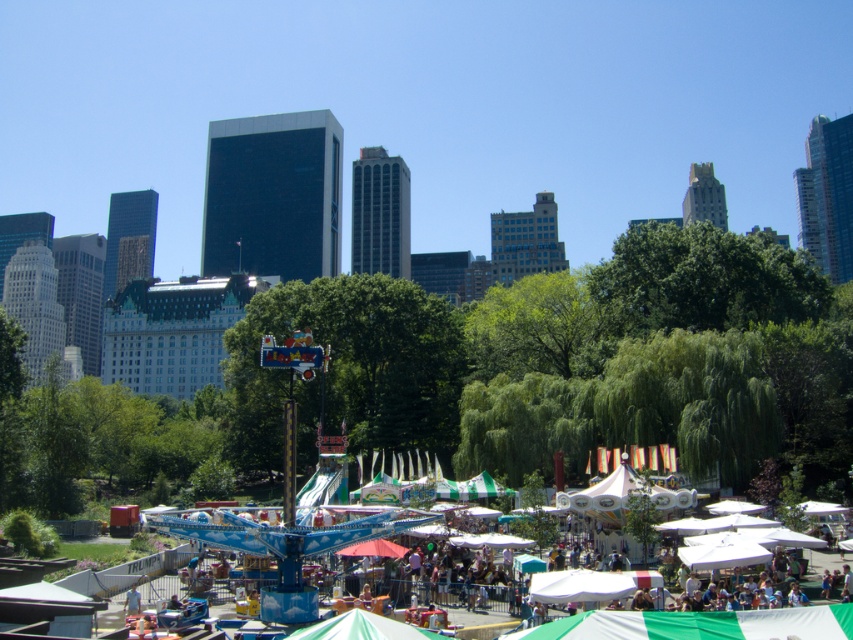
Question: From the image, what is the correct spatial relationship of green fabric canopy at lower center in relation to green fabric canopy at center?

Choices:
 (A) left
 (B) right

Answer: (B)

Question: Is green fabric canopy at lower center above green fabric canopy at center?

Choices:
 (A) no
 (B) yes

Answer: (B)

Question: Can you confirm if green fabric canopy at lower center is wider than green fabric canopy at center?

Choices:
 (A) yes
 (B) no

Answer: (A)

Question: Which point is farther to the camera?

Choices:
 (A) (830, 632)
 (B) (370, 614)

Answer: (B)

Question: Which of the following is the closest to the observer?

Choices:
 (A) (836, 621)
 (B) (395, 637)

Answer: (A)